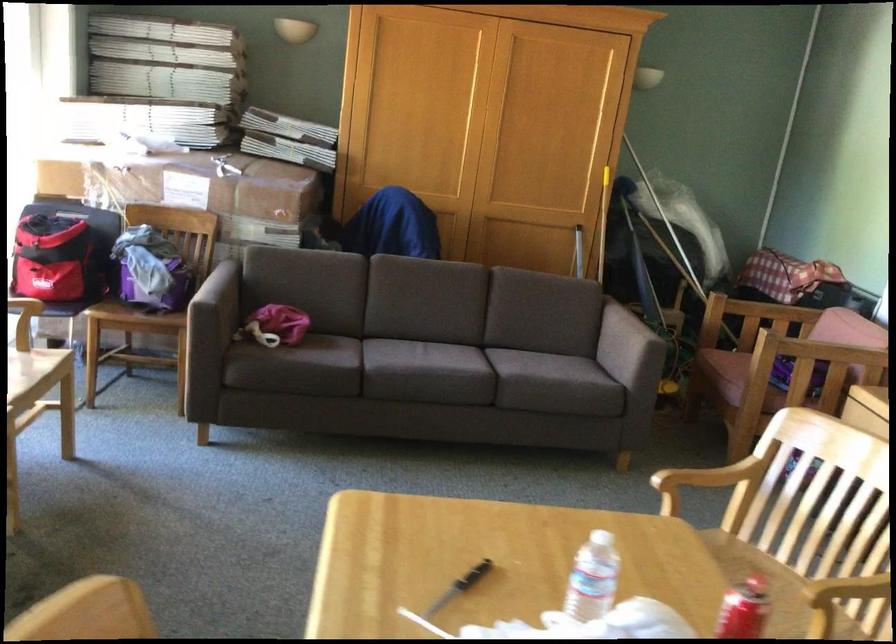
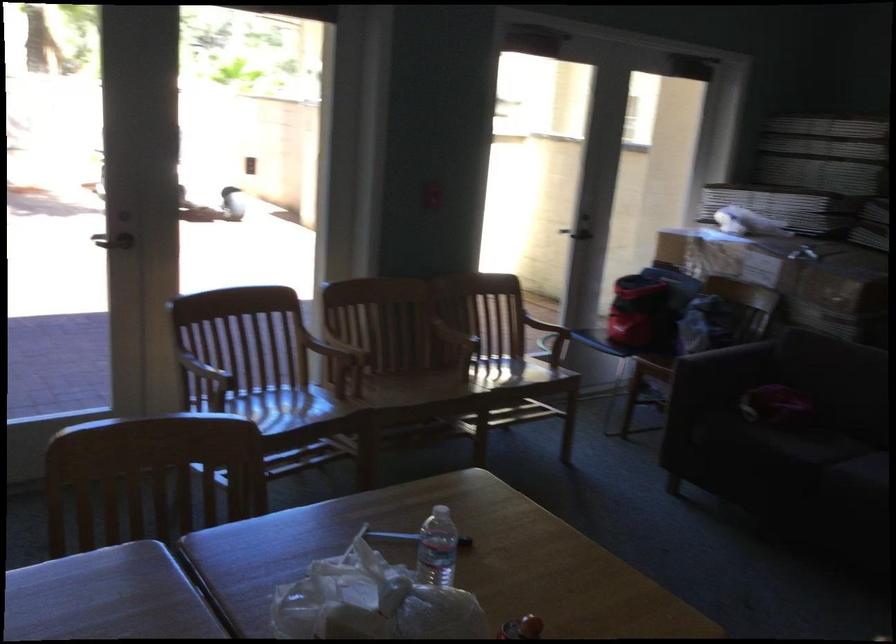
In the second image, find the point that corresponds to point 558,576 in the first image.

(437, 547)